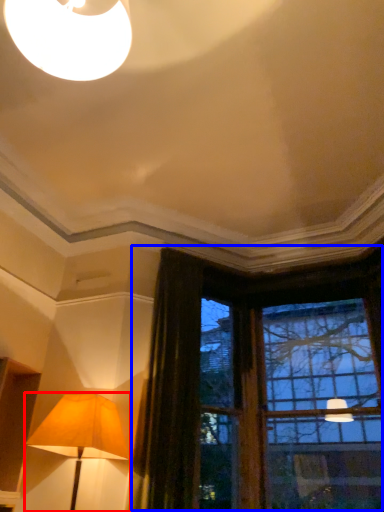
Question: Which object is closer to the camera taking this photo, lamp (highlighted by a red box) or window (highlighted by a blue box)?

Choices:
 (A) lamp
 (B) window

Answer: (A)